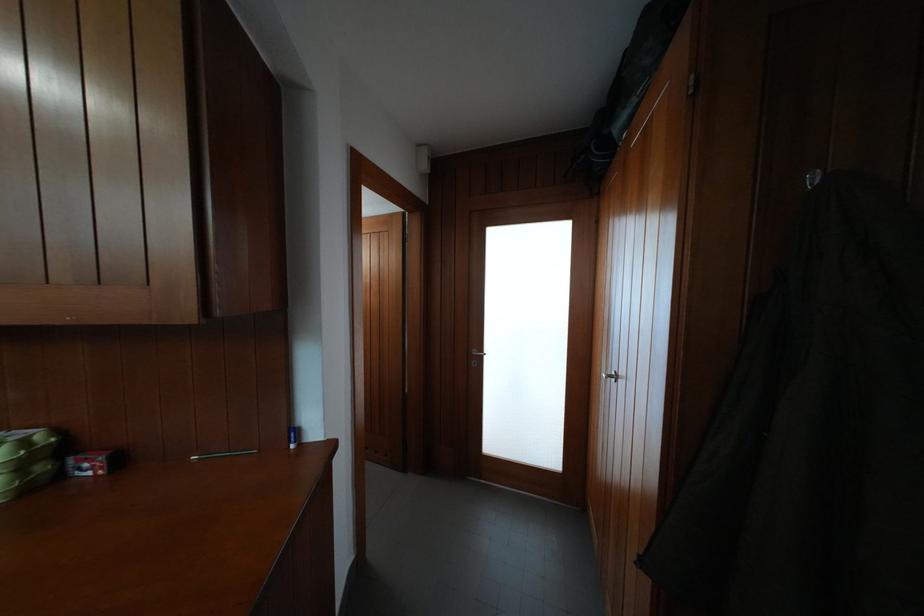
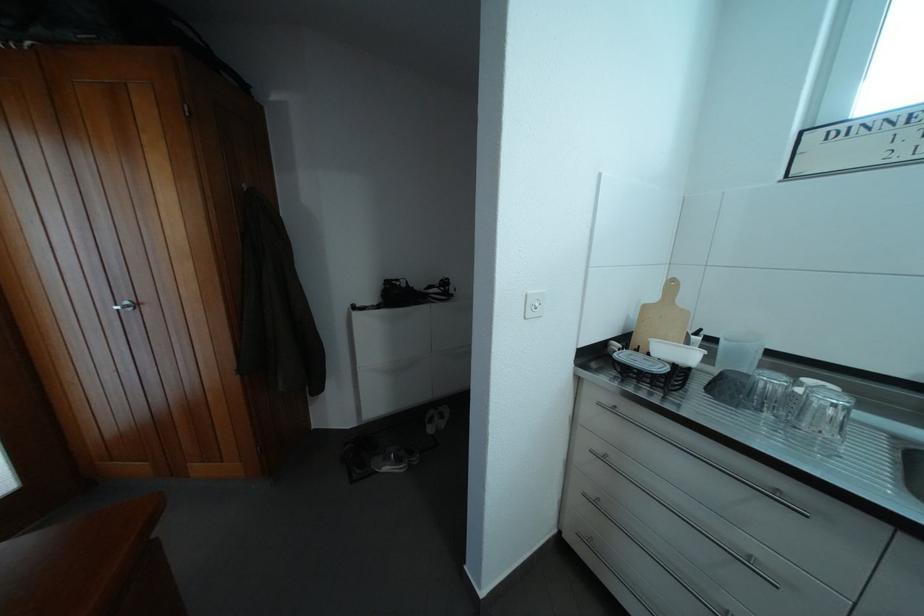
How did the camera likely rotate?

The rotation direction of the camera is right-down.